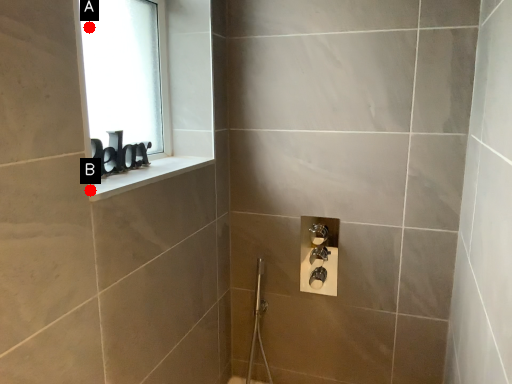
Question: Two points are circled on the image, labeled by A and B beside each circle. Which point appears closest to the camera in this image?

Choices:
 (A) A is closer
 (B) B is closer

Answer: (B)